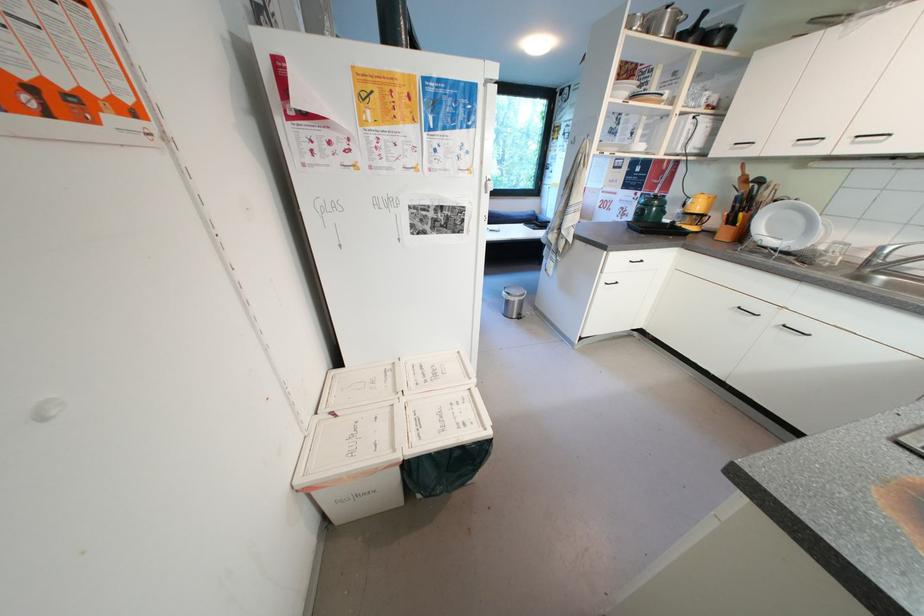
Which object does [785,225] point to?

This point indicates the white plate.